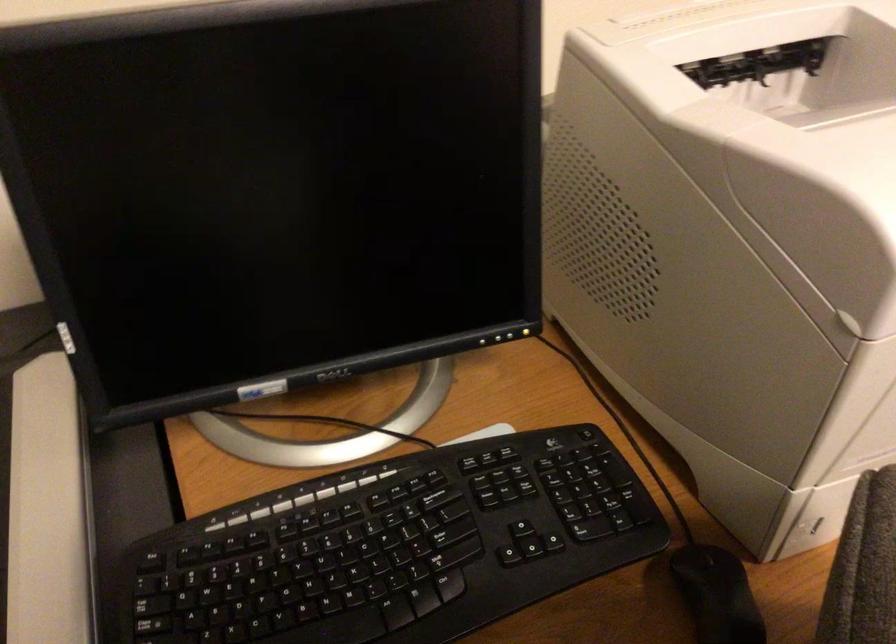
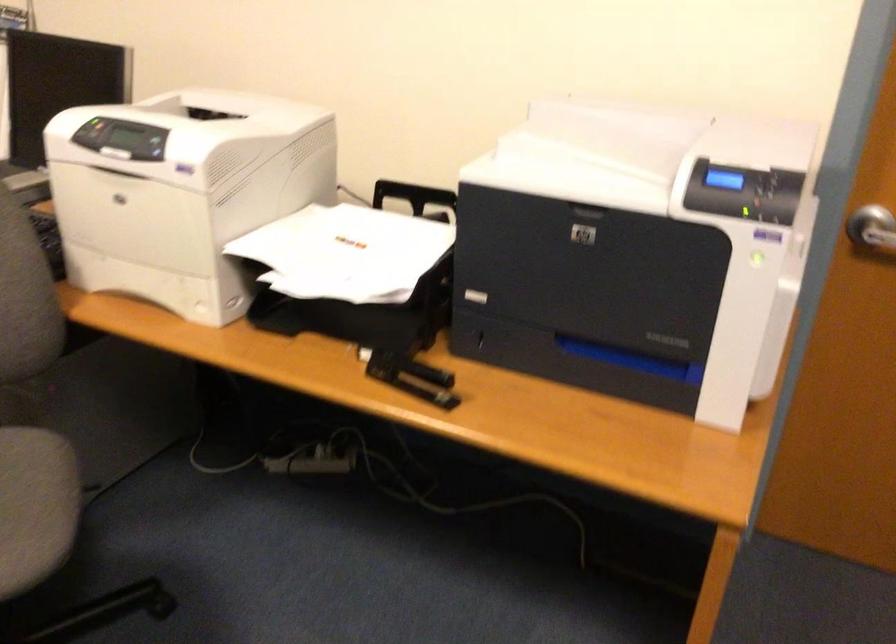
Question: I am providing you with two images of the same scene from different viewpoints. Please identify which objects are invisible in image2.

Choices:
 (A) white chopsticks
 (B) black stapler
 (C) printer control buttons
 (D) monitor control button

Answer: (D)